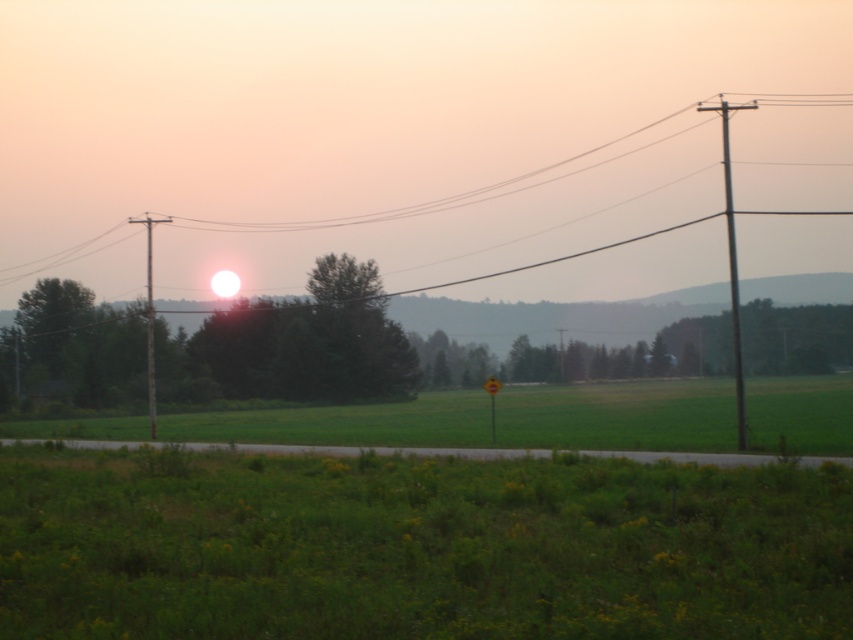
You are a bird flying over the rural landscape. You notice the metallic wire at upper center and the brown wooden telegraph pole at left. Which object would appear larger to you from above?

The metallic wire at upper center would appear larger than the brown wooden telegraph pole at left because it is bigger in size according to the description.

You are standing at the center of the small road in the middle of the frame. Which direction should you look to see the brown wooden telegraph pole at left?

The brown wooden telegraph pole at left is located at point (149, 321), which is to the left side of the frame. Therefore, you should look to your left to see it.

You are a bird flying at an altitude of 30 meters. You spot the metallic wire at upper center in the distance. Can you safely fly under it without hitting the wire?

The metallic wire at upper center is 34.76 meters from the viewer. Since the bird is flying at 30 meters altitude, it can safely fly under the wire as it is lower than the bird.